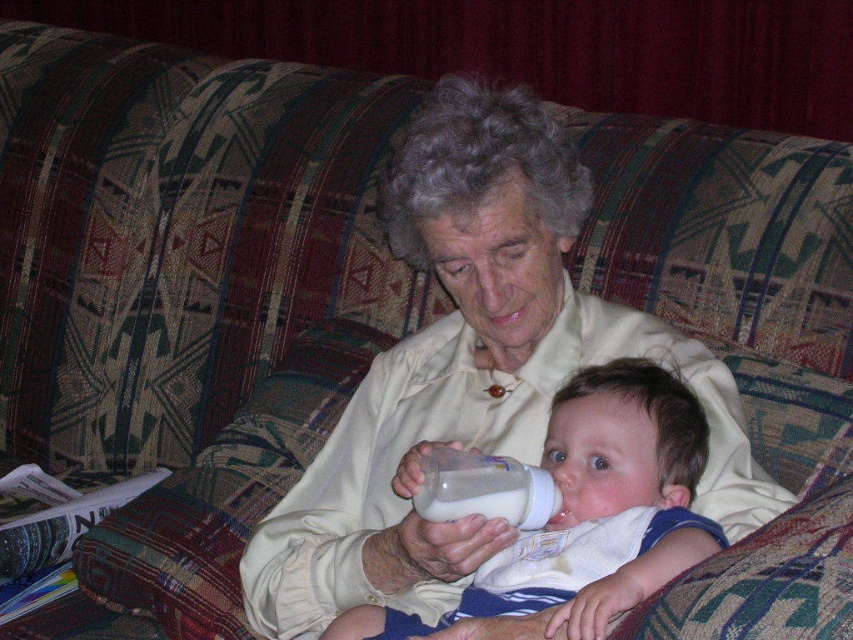
You are a caregiver in a nursery and need to ensure the baby is fed properly. You see the white cotton bib at center and the white plastic baby bottle at center. Which item should you use to prevent the baby from getting milk on their clothes?

The white cotton bib at center should be used to prevent the baby from getting milk on their clothes, as it is positioned under the white plastic baby bottle at center, indicating its placement beneath the feeding source.

You are a caregiver looking after a baby. You see the white cotton bib at center and the white plastic baby bottle at center on the couch. Which item is taller?

The white cotton bib at center is taller than the white plastic baby bottle at center.

Looking at the scene described, where is the white cotton bib at center in relation to the white plastic baby bottle at center?

The white cotton bib at center is to the right of the white plastic baby bottle at center.